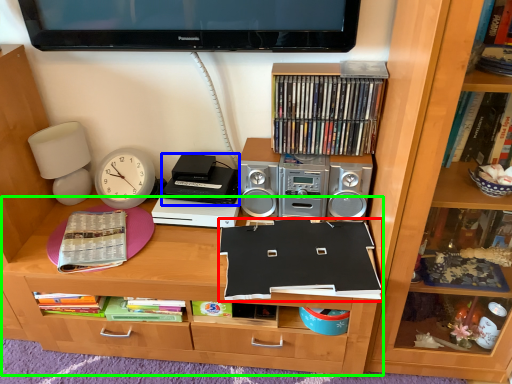
Question: Which object is the farthest from paperback book (highlighted by a red box)? Choose among these: cassette (highlighted by a blue box) or desk (highlighted by a green box).

Choices:
 (A) cassette
 (B) desk

Answer: (A)